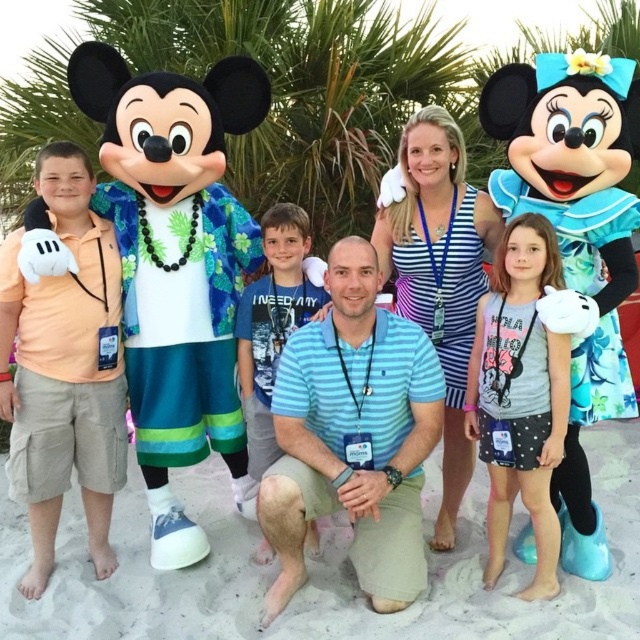
Consider the image. Is beige sand at center in front of blue cotton shirt at center?

Yes, beige sand at center is in front of blue cotton shirt at center.

Which is behind, point (45, 595) or point (276, 273)?

The point (276, 273) is more distant.

Where is `beige sand at center`? beige sand at center is located at coordinates (316, 572).

Image resolution: width=640 pixels, height=640 pixels. What are the coordinates of `beige sand at center` in the screenshot? It's located at (316, 572).

Does beige sand at center appear under white dotted fabric dress at lower right?

Indeed, beige sand at center is positioned under white dotted fabric dress at lower right.

Is point (593, 472) in front of point (500, 452)?

No, (593, 472) is behind (500, 452).

The width and height of the screenshot is (640, 640). Find the location of `beige sand at center`. beige sand at center is located at coordinates coord(316,572).

Can you confirm if white dotted fabric dress at lower right is positioned above blue cotton shirt at center?

Actually, white dotted fabric dress at lower right is below blue cotton shirt at center.

Can you confirm if white dotted fabric dress at lower right is wider than blue cotton shirt at center?

Incorrect, white dotted fabric dress at lower right's width does not surpass blue cotton shirt at center's.

Image resolution: width=640 pixels, height=640 pixels. Find the location of `white dotted fabric dress at lower right`. white dotted fabric dress at lower right is located at coordinates (518, 396).

This screenshot has height=640, width=640. I want to click on white dotted fabric dress at lower right, so [x=518, y=396].